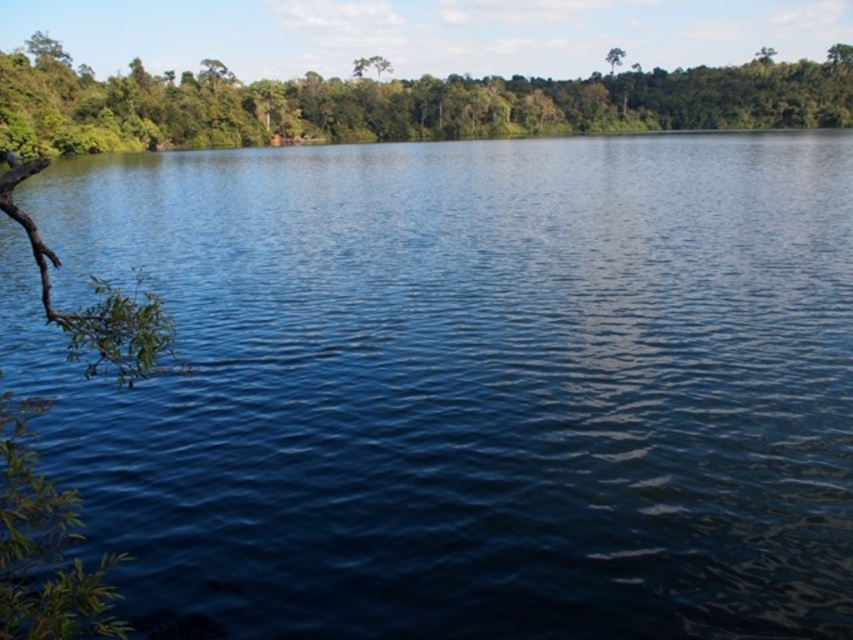
Question: Which object appears closest to the camera in this image?

Choices:
 (A) green leafy tree at upper center
 (B) green leafy tree at upper left

Answer: (B)

Question: Does green leafy tree at upper left have a larger size compared to green leafy tree at upper center?

Choices:
 (A) no
 (B) yes

Answer: (B)

Question: Which point is closer to the camera?

Choices:
 (A) (619, 54)
 (B) (805, 72)

Answer: (B)

Question: Observing the image, what is the correct spatial positioning of green leafy tree at upper left in reference to green leafy tree at upper center?

Choices:
 (A) above
 (B) below

Answer: (B)

Question: Observing the image, what is the correct spatial positioning of green leafy tree at upper left in reference to green leafy tree at upper center?

Choices:
 (A) right
 (B) left

Answer: (B)